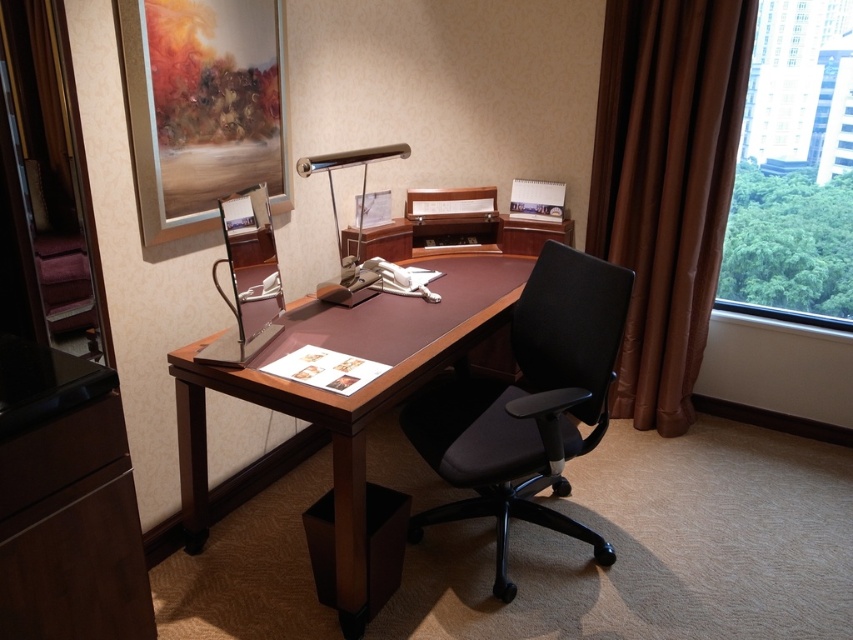
You are standing in the home office and want to reach both the point at coordinates (642, 248) and the point at coordinates (352, 301). Which point will you need to move closer to the desk to reach?

Point (352, 301) is closer to the desk, so you would need to move closer to the desk to reach it since it is nearer than point (642, 248) which is further away.

You are a delivery person who needs to place a package on the desk between the brown velvet curtain at right and the satin silver desk lamp at center. The package is 4 feet long. Will it fit between them?

The brown velvet curtain at right and the satin silver desk lamp at center are 3.92 feet apart. Since the package is 4 feet long, it will not fit between them as the distance is slightly shorter than the package length.

You are standing in the home office and want to adjust the brown velvet curtain at right. What are the coordinates where you should reach to interact with it?

The brown velvet curtain at right is located at coordinates point [666,184].